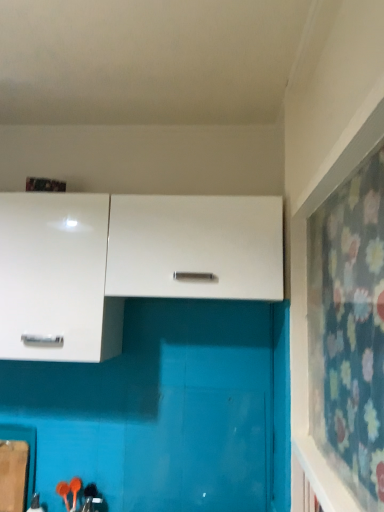
Question: From a real-world perspective, is white glossy cabinet at upper left, which is the 1th cabinetry in left-to-right order, on white matte cabinet at center, placed as the 1th cabinetry when sorted from right to left?

Choices:
 (A) yes
 (B) no

Answer: (B)

Question: Can white matte cabinet at center, placed as the 1th cabinetry when sorted from right to left, be found inside white glossy cabinet at upper left, which is the 1th cabinetry in left-to-right order?

Choices:
 (A) yes
 (B) no

Answer: (B)

Question: Does white glossy cabinet at upper left, marked as the second cabinetry in a right-to-left arrangement, have a greater height compared to white matte cabinet at center, placed as the 1th cabinetry when sorted from right to left?

Choices:
 (A) no
 (B) yes

Answer: (B)

Question: Could you tell me if white glossy cabinet at upper left, marked as the second cabinetry in a right-to-left arrangement, is facing white matte cabinet at center, acting as the 2th cabinetry starting from the left?

Choices:
 (A) no
 (B) yes

Answer: (A)

Question: Are white glossy cabinet at upper left, marked as the second cabinetry in a right-to-left arrangement, and white matte cabinet at center, placed as the 1th cabinetry when sorted from right to left, making contact?

Choices:
 (A) yes
 (B) no

Answer: (B)

Question: Considering the relative sizes of white glossy cabinet at upper left, marked as the second cabinetry in a right-to-left arrangement, and white matte cabinet at center, acting as the 2th cabinetry starting from the left, in the image provided, is white glossy cabinet at upper left, marked as the second cabinetry in a right-to-left arrangement, thinner than white matte cabinet at center, acting as the 2th cabinetry starting from the left,?

Choices:
 (A) yes
 (B) no

Answer: (B)

Question: Can you confirm if floral fabric curtain at right is shorter than white matte cabinet at center, placed as the 1th cabinetry when sorted from right to left?

Choices:
 (A) yes
 (B) no

Answer: (B)

Question: From a real-world perspective, is floral fabric curtain at right over white matte cabinet at center, placed as the 1th cabinetry when sorted from right to left?

Choices:
 (A) no
 (B) yes

Answer: (A)

Question: Considering the relative positions of floral fabric curtain at right and white matte cabinet at center, placed as the 1th cabinetry when sorted from right to left, in the image provided, is floral fabric curtain at right to the left of white matte cabinet at center, placed as the 1th cabinetry when sorted from right to left, from the viewer's perspective?

Choices:
 (A) no
 (B) yes

Answer: (A)

Question: Is floral fabric curtain at right bigger than white matte cabinet at center, acting as the 2th cabinetry starting from the left?

Choices:
 (A) yes
 (B) no

Answer: (B)

Question: Is floral fabric curtain at right to the right of white matte cabinet at center, acting as the 2th cabinetry starting from the left, from the viewer's perspective?

Choices:
 (A) no
 (B) yes

Answer: (B)

Question: Considering the relative sizes of floral fabric curtain at right and white matte cabinet at center, placed as the 1th cabinetry when sorted from right to left, in the image provided, is floral fabric curtain at right smaller than white matte cabinet at center, placed as the 1th cabinetry when sorted from right to left,?

Choices:
 (A) yes
 (B) no

Answer: (A)

Question: Is white matte cabinet at center, placed as the 1th cabinetry when sorted from right to left, at the right side of floral fabric curtain at right?

Choices:
 (A) yes
 (B) no

Answer: (B)